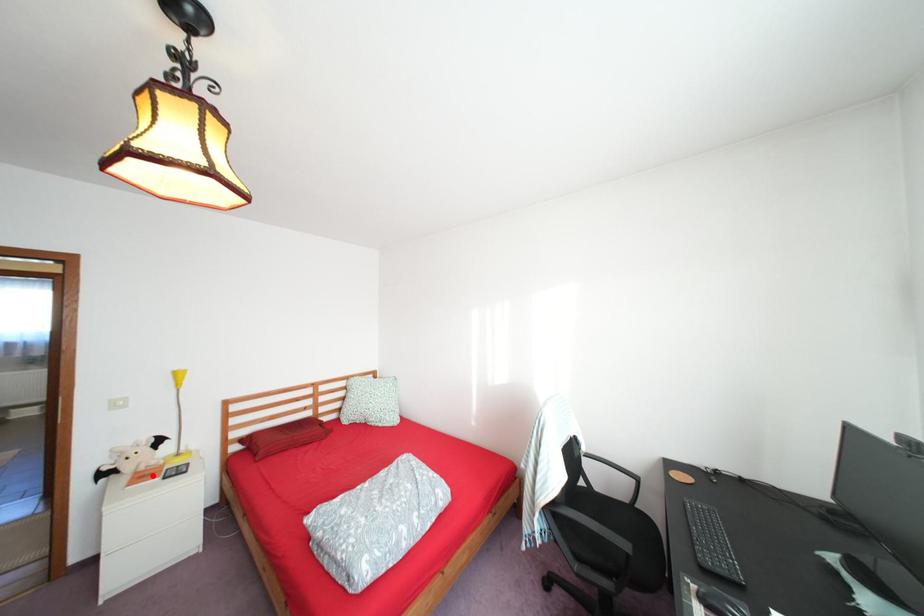
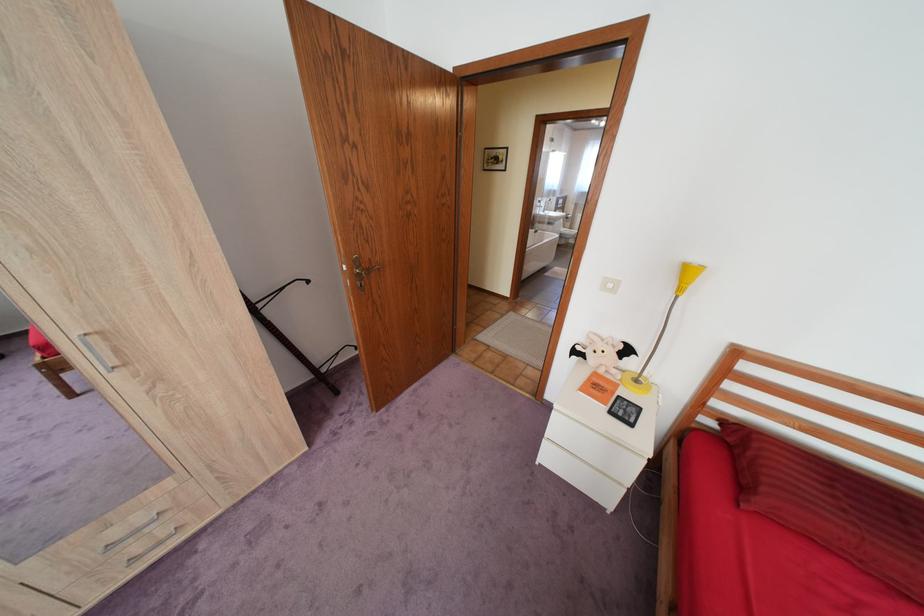
In the second image, find the point that corresponds to the highlighted location in the first image.

(606, 386)